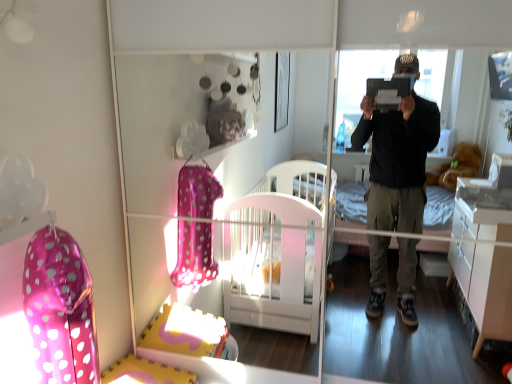
The image size is (512, 384). What do you see at coordinates (60, 309) in the screenshot?
I see `pink metallic balloon at left` at bounding box center [60, 309].

This screenshot has width=512, height=384. I want to click on pink metallic balloon at left, so click(60, 309).

The width and height of the screenshot is (512, 384). Find the location of `pink metallic balloon at left`. pink metallic balloon at left is located at coordinates 60,309.